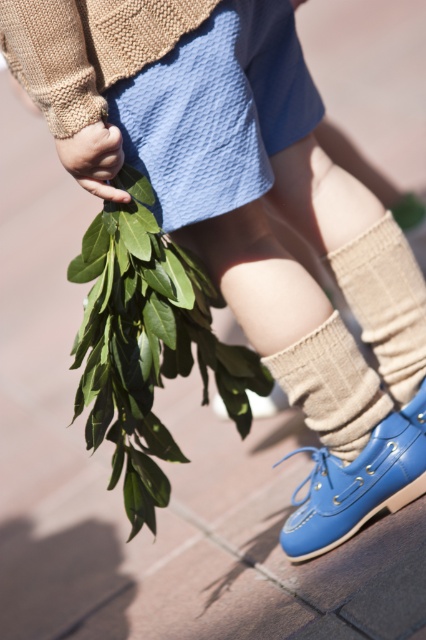
Looking at the scene, where is the green leafy branch at lower left in relation to the knit beige sock at lower center?

The green leafy branch at lower left is to the left of the knit beige sock at lower center.

From the picture: You are a fashion designer observing the image. You need to decide which item is taller between the green leafy branch at lower left and the beige knitted sock at lower center. Which one is taller?

The green leafy branch at lower left is taller than the beige knitted sock at lower center according to the description.